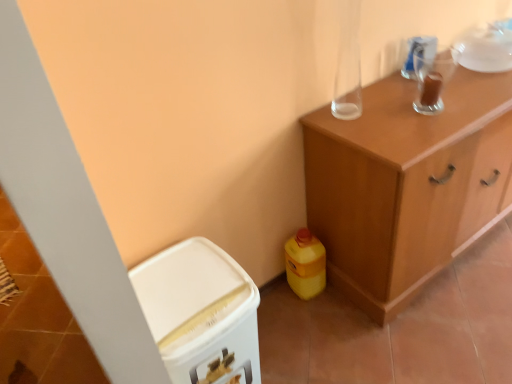
Question: Would you say white plastic bin at lower left, which appears as the second cabinetry when viewed from the right, is part of wooden cabinet at upper right, arranged as the 2th cabinetry when viewed from the left,'s contents?

Choices:
 (A) no
 (B) yes

Answer: (A)

Question: From a real-world perspective, does wooden cabinet at upper right, which is the first cabinetry from right to left, stand above white plastic bin at lower left, which appears as the second cabinetry when viewed from the right?

Choices:
 (A) yes
 (B) no

Answer: (A)

Question: Does wooden cabinet at upper right, arranged as the 2th cabinetry when viewed from the left, have a lesser width compared to white plastic bin at lower left, positioned as the first cabinetry in left-to-right order?

Choices:
 (A) yes
 (B) no

Answer: (B)

Question: Is white plastic bin at lower left, positioned as the first cabinetry in left-to-right order, at the back of wooden cabinet at upper right, which is the first cabinetry from right to left?

Choices:
 (A) no
 (B) yes

Answer: (A)

Question: Is wooden cabinet at upper right, which is the first cabinetry from right to left, closer to camera compared to white plastic bin at lower left, which appears as the second cabinetry when viewed from the right?

Choices:
 (A) no
 (B) yes

Answer: (A)

Question: Is yellow plastic bottle at lower right taller or shorter than transparent glass cup at upper right?

Choices:
 (A) tall
 (B) short

Answer: (A)

Question: Do you think yellow plastic bottle at lower right is within transparent glass cup at upper right, or outside of it?

Choices:
 (A) outside
 (B) inside

Answer: (A)

Question: Is yellow plastic bottle at lower right to the left or to the right of transparent glass cup at upper right in the image?

Choices:
 (A) left
 (B) right

Answer: (A)

Question: Is point (289, 258) positioned closer to the camera than point (418, 59)?

Choices:
 (A) farther
 (B) closer

Answer: (A)

Question: Considering the positions of yellow plastic bottle at lower right and white plastic bin at lower left, positioned as the first cabinetry in left-to-right order, in the image, is yellow plastic bottle at lower right bigger or smaller than white plastic bin at lower left, positioned as the first cabinetry in left-to-right order,?

Choices:
 (A) big
 (B) small

Answer: (B)

Question: Considering the positions of point (290, 246) and point (172, 269), is point (290, 246) closer or farther from the camera than point (172, 269)?

Choices:
 (A) farther
 (B) closer

Answer: (A)

Question: From the image's perspective, is yellow plastic bottle at lower right above or below white plastic bin at lower left, positioned as the first cabinetry in left-to-right order?

Choices:
 (A) below
 (B) above

Answer: (B)

Question: Is yellow plastic bottle at lower right wider or thinner than white plastic bin at lower left, positioned as the first cabinetry in left-to-right order?

Choices:
 (A) wide
 (B) thin

Answer: (B)

Question: Considering the positions of point (392, 203) and point (214, 347), is point (392, 203) closer or farther from the camera than point (214, 347)?

Choices:
 (A) closer
 (B) farther

Answer: (B)

Question: From the image's perspective, is wooden cabinet at upper right, which is the first cabinetry from right to left, positioned above or below white plastic bin at lower left, positioned as the first cabinetry in left-to-right order?

Choices:
 (A) below
 (B) above

Answer: (B)